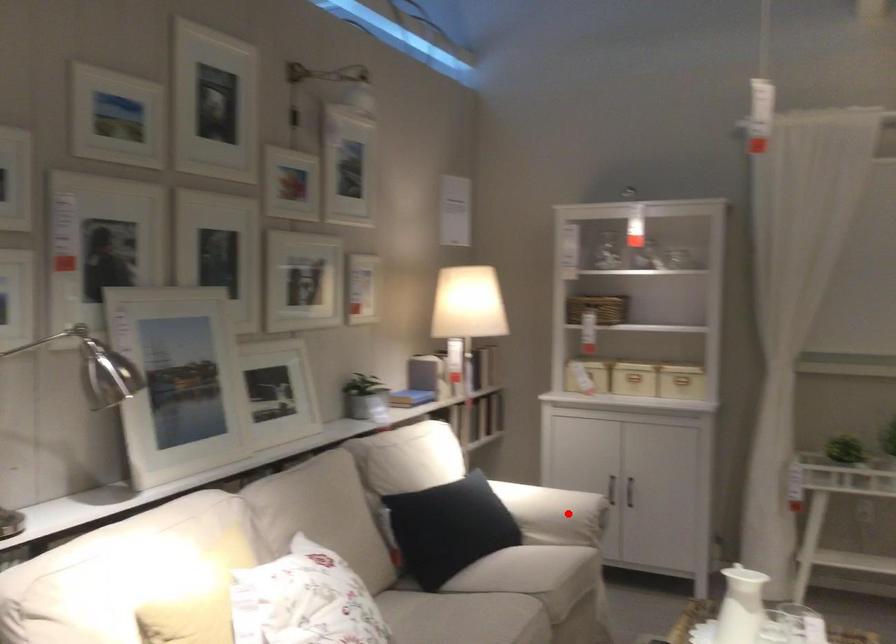
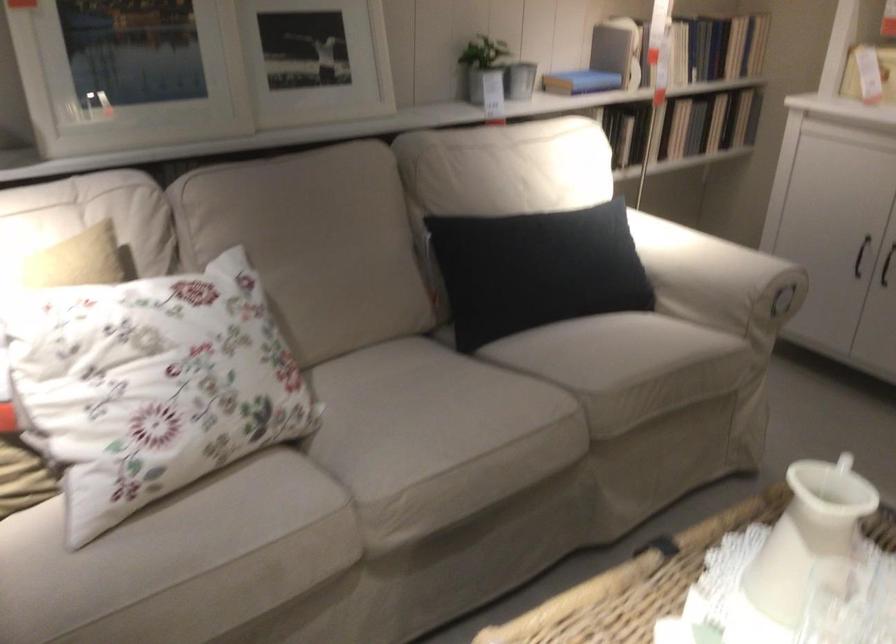
Question: I am providing you with two images of the same scene from different viewpoints. Given a red point in image1, look at the same physical point in image2. Is it:

Choices:
 (A) Closer to the viewpoint
 (B) Farther from the viewpoint

Answer: (A)